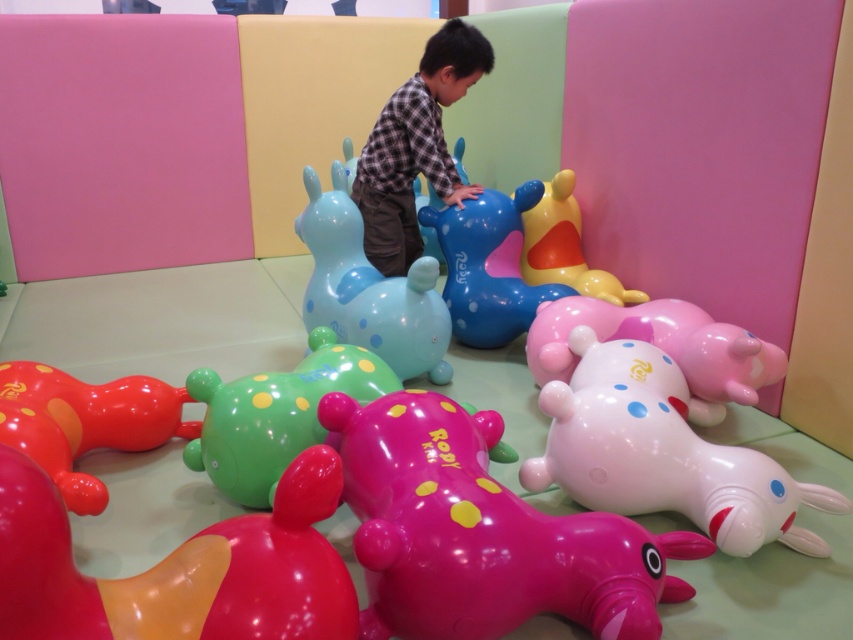
You are a parent trying to choose between the pink glossy dog at center and the rubber duck at upper right for your child. Based on the size, which toy would you recommend?

The pink glossy dog at center is larger in size compared to the rubber duck at upper right, so it would be the better choice if you prefer a bigger toy.

You are a parent trying to locate your child who is wearing a matte plaid shirt at center in this play area. Where would you look relative to the green rubber dog at center?

The green rubber dog at center is positioned under the matte plaid shirt at center, so the parent should look directly above the green rubber dog at center to find the child wearing the matte plaid shirt at center.

You are standing in the play area and want to pick up two specific inflatable toys. The first toy is located at point (544, 556) and the second is at point (564, 241). If you move directly towards the second toy, will you pass by the first toy before reaching the second one?

Point (544, 556) is in front of point (564, 241), so moving towards the second toy would require passing by the first toy before reaching the second one.